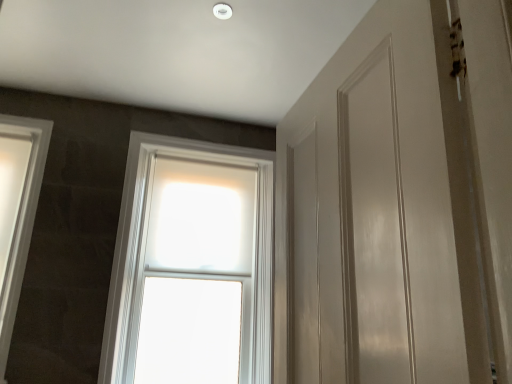
Question: From a real-world perspective, is white glossy window at left, which is counted as the second window, starting from the right, under white frosted glass window at center, which is the second window from left to right?

Choices:
 (A) no
 (B) yes

Answer: (A)

Question: Is white glossy window at left, which is the 1th window from left to right, facing away from white frosted glass window at center, the first window from the right?

Choices:
 (A) yes
 (B) no

Answer: (B)

Question: Is white glossy window at left, which is counted as the second window, starting from the right, thinner than white frosted glass window at center, the first window from the right?

Choices:
 (A) no
 (B) yes

Answer: (B)

Question: Is white glossy window at left, which is the 1th window from left to right, not within white frosted glass window at center, the first window from the right?

Choices:
 (A) yes
 (B) no

Answer: (A)

Question: Does white glossy window at left, which is the 1th window from left to right, have a smaller size compared to white frosted glass window at center, the first window from the right?

Choices:
 (A) no
 (B) yes

Answer: (B)

Question: Considering the relative sizes of white glossy window at left, which is the 1th window from left to right, and white frosted glass window at center, the first window from the right, in the image provided, is white glossy window at left, which is the 1th window from left to right, taller than white frosted glass window at center, the first window from the right,?

Choices:
 (A) yes
 (B) no

Answer: (B)

Question: Is white frosted glass window at center, the first window from the right, turned away from white glossy window at left, which is the 1th window from left to right?

Choices:
 (A) yes
 (B) no

Answer: (B)

Question: From the image's perspective, is white frosted glass window at center, the first window from the right, below white glossy window at left, which is counted as the second window, starting from the right?

Choices:
 (A) yes
 (B) no

Answer: (A)

Question: From the image's perspective, does white frosted glass window at center, the first window from the right, appear higher than white glossy window at left, which is counted as the second window, starting from the right?

Choices:
 (A) no
 (B) yes

Answer: (A)

Question: Does white frosted glass window at center, which is the second window from left to right, have a smaller size compared to white glossy window at left, which is the 1th window from left to right?

Choices:
 (A) yes
 (B) no

Answer: (B)

Question: Can you confirm if white frosted glass window at center, the first window from the right, is positioned to the left of white glossy window at left, which is counted as the second window, starting from the right?

Choices:
 (A) no
 (B) yes

Answer: (A)

Question: Is white frosted glass window at center, which is the second window from left to right, closer to camera compared to white glossy window at left, which is counted as the second window, starting from the right?

Choices:
 (A) no
 (B) yes

Answer: (A)

Question: In the image, is white frosted glass window at center, which is the second window from left to right, positioned in front of or behind white glossy window at left, which is the 1th window from left to right?

Choices:
 (A) front
 (B) behind

Answer: (B)